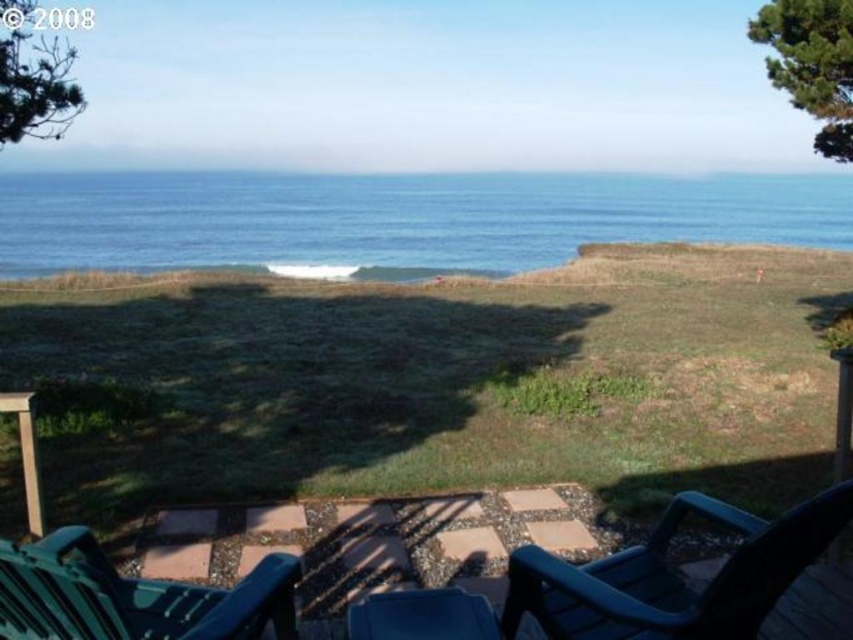
Between green plastic chairs at lower center and blue plastic chair at lower center, which one appears on the left side from the viewer's perspective?

From the viewer's perspective, blue plastic chair at lower center appears more on the left side.

Does point (113, 564) lie behind point (401, 602)?

Yes, point (113, 564) is farther from viewer.

This screenshot has height=640, width=853. Find the location of `green plastic chairs at lower center`. green plastic chairs at lower center is located at coordinates (692, 580).

Does blue water at center lie behind green plastic chairs at lower center?

Yes, blue water at center is further from the viewer.

Image resolution: width=853 pixels, height=640 pixels. What do you see at coordinates (393, 218) in the screenshot?
I see `blue water at center` at bounding box center [393, 218].

This screenshot has width=853, height=640. Identify the location of blue water at center. (393, 218).

At what (x,y) coordinates should I click in order to perform the action: click on blue water at center. Please return your answer as a coordinate pair (x, y). Looking at the image, I should click on (393, 218).

Does blue water at center have a larger size compared to green plastic chair at lower left?

Correct, blue water at center is larger in size than green plastic chair at lower left.

Is blue water at center thinner than green plastic chair at lower left?

No, blue water at center is not thinner than green plastic chair at lower left.

Which is in front, point (352, 189) or point (10, 548)?

Point (10, 548) is in front.

Locate an element on the screen. The height and width of the screenshot is (640, 853). blue water at center is located at coordinates (393, 218).